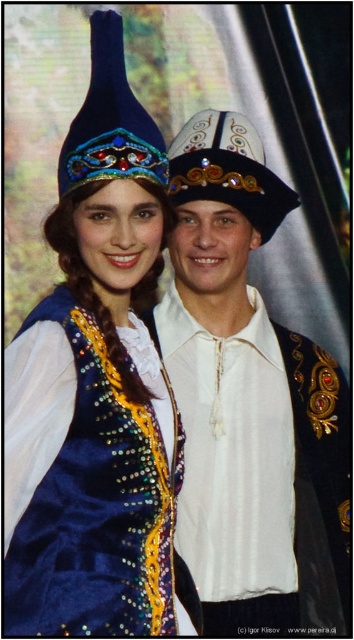
How distant is velvet blue dress at center from white satin shirt at center?

A distance of 29.63 inches exists between velvet blue dress at center and white satin shirt at center.

Is the position of velvet blue dress at center less distant than that of white satin shirt at center?

Yes, velvet blue dress at center is closer to the viewer.

Between point (158, 368) and point (250, 417), which one is positioned in front?

Positioned in front is point (158, 368).

Identify the location of velvet blue dress at center. The width and height of the screenshot is (354, 640). (94, 387).